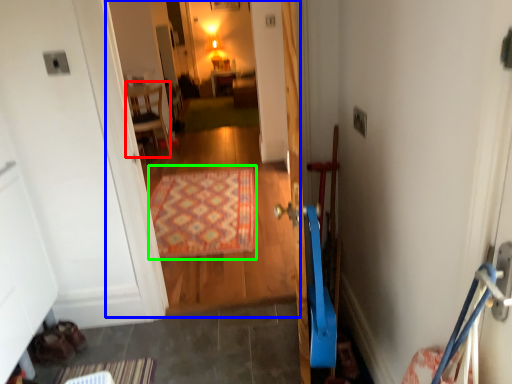
Question: Based on their relative distances, which object is farther from furniture (highlighted by a red box)? Choose from corridor (highlighted by a blue box) and doormat (highlighted by a green box).

Choices:
 (A) corridor
 (B) doormat

Answer: (B)